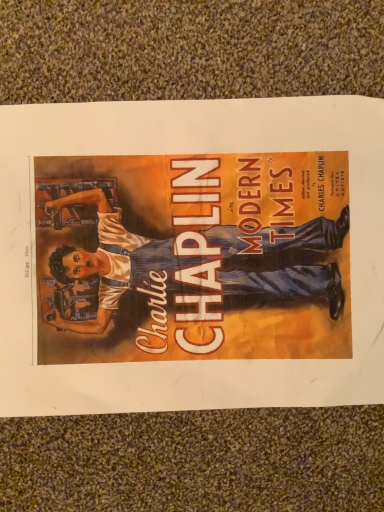
I want to click on blank space situated above matte blue overalls at center (from a real-world perspective), so click(200, 254).